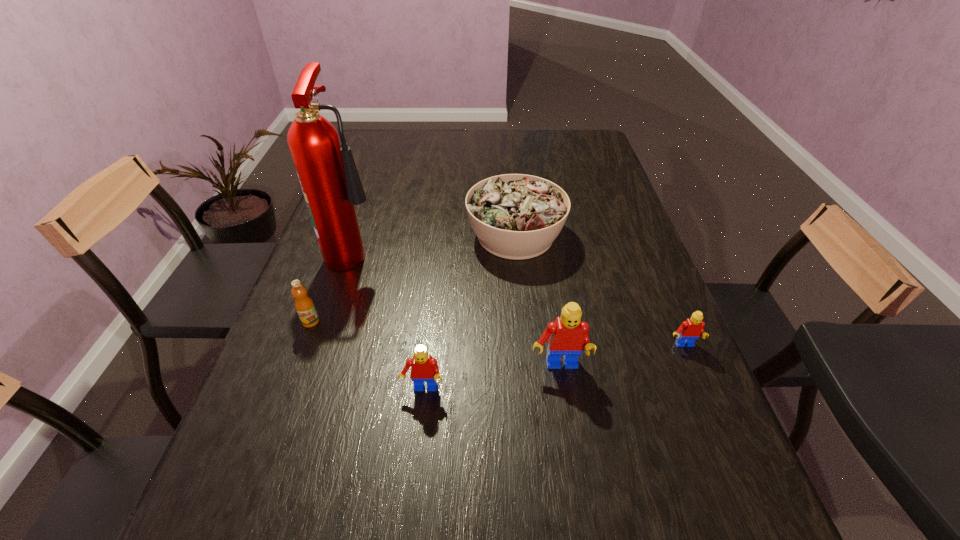
The width and height of the screenshot is (960, 540). What are the coordinates of `vacant region at the left edge of the desktop` in the screenshot? It's located at (336, 276).

Identify the location of vacant space at the right edge of the desktop. (581, 206).

The height and width of the screenshot is (540, 960). Find the location of `vacant region at the far left corner`. vacant region at the far left corner is located at coordinates (391, 133).

I want to click on vacant point located between the fourth object from right to left and the tallest object, so click(389, 320).

The width and height of the screenshot is (960, 540). In order to click on empty location between the tallest object and the leftmost Lego in this screenshot , I will do `click(389, 320)`.

This screenshot has height=540, width=960. In order to click on free spot between the farthest Lego and the tallest object in this screenshot , I will do `click(519, 298)`.

Identify the location of free spot between the fire extinguisher and the tallest Lego. (457, 309).

This screenshot has width=960, height=540. What are the coordinates of `blank region between the third object from left to right and the fire extinguisher` in the screenshot? It's located at (389, 320).

At what (x,y) coordinates should I click in order to perform the action: click on vacant space in between the salad and the fire extinguisher. Please return your answer as a coordinate pair (x, y). Looking at the image, I should click on (435, 243).

The image size is (960, 540). Find the location of `vacant space that's between the salad and the tallest object`. vacant space that's between the salad and the tallest object is located at coordinates (435, 243).